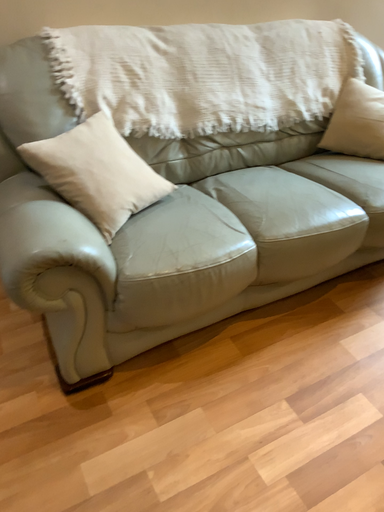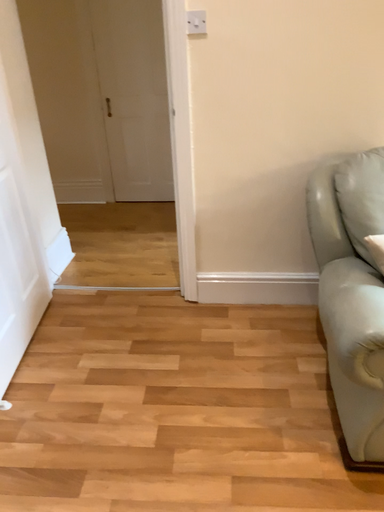
Question: Which way did the camera rotate in the video?

Choices:
 (A) rotated left
 (B) rotated right

Answer: (A)